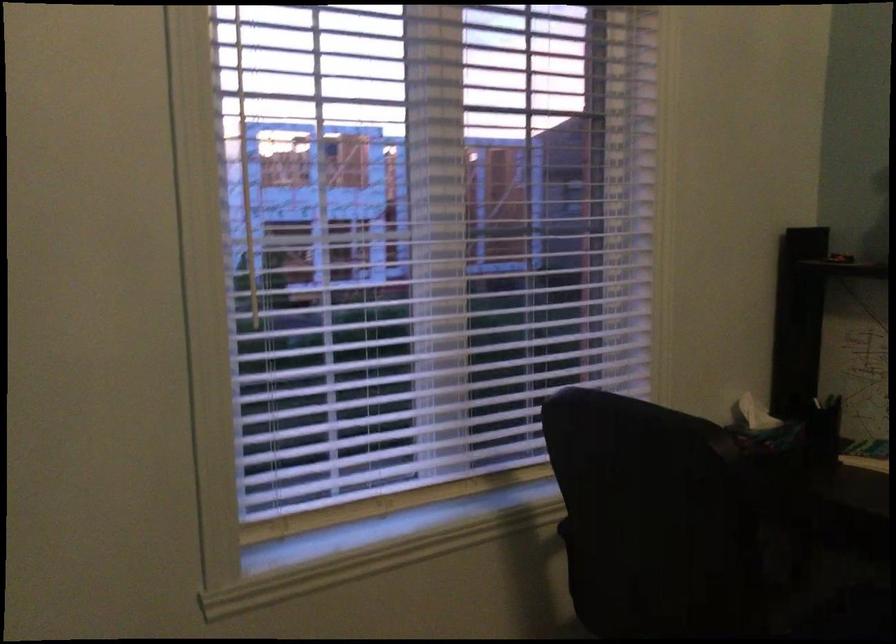
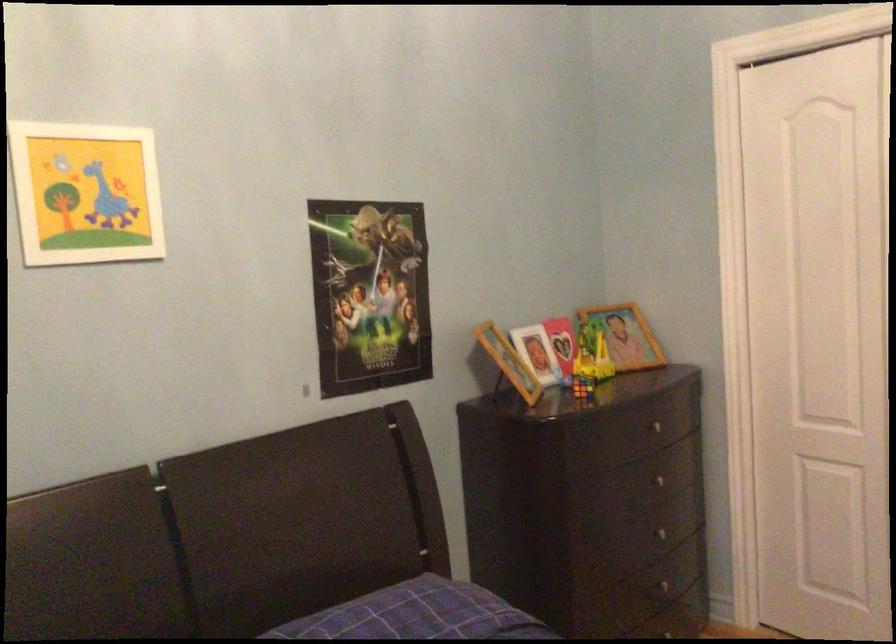
Question: Based on the continuous images, in which direction is the camera rotating? Reply with the corresponding letter.

Choices:
 (A) Left
 (B) Right
 (C) Up
 (D) Down

Answer: (B)